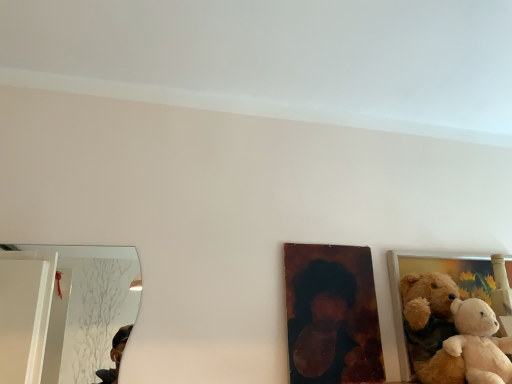
Question: Would you say fluffy fabric teddy bear at right, which is the 2th picture frame from left to right, is part of soft beige plush at right's contents?

Choices:
 (A) yes
 (B) no

Answer: (B)

Question: Considering the relative sizes of soft beige plush at right and fluffy fabric teddy bear at right, which is the 2th picture frame from left to right, in the image provided, is soft beige plush at right taller than fluffy fabric teddy bear at right, which is the 2th picture frame from left to right,?

Choices:
 (A) no
 (B) yes

Answer: (A)

Question: Is soft beige plush at right closer to the viewer compared to fluffy fabric teddy bear at right, which ranks as the 1th picture frame in right-to-left order?

Choices:
 (A) no
 (B) yes

Answer: (B)

Question: Is the surface of soft beige plush at right in direct contact with fluffy fabric teddy bear at right, which ranks as the 1th picture frame in right-to-left order?

Choices:
 (A) yes
 (B) no

Answer: (B)

Question: Is soft beige plush at right to the left of fluffy fabric teddy bear at right, which ranks as the 1th picture frame in right-to-left order, from the viewer's perspective?

Choices:
 (A) no
 (B) yes

Answer: (B)

Question: Does soft beige plush at right have a larger size compared to fluffy fabric teddy bear at right, which is the 2th picture frame from left to right?

Choices:
 (A) yes
 (B) no

Answer: (B)

Question: From a real-world perspective, is fluffy fabric teddy bear at right, which ranks as the 1th picture frame in right-to-left order, under wooden portrait at center, the second picture frame in the right-to-left sequence?

Choices:
 (A) yes
 (B) no

Answer: (A)

Question: Can you confirm if fluffy fabric teddy bear at right, which is the 2th picture frame from left to right, is taller than wooden portrait at center, the second picture frame in the right-to-left sequence?

Choices:
 (A) yes
 (B) no

Answer: (A)

Question: Is fluffy fabric teddy bear at right, which is the 2th picture frame from left to right, facing away from wooden portrait at center, the first picture frame in the left-to-right sequence?

Choices:
 (A) no
 (B) yes

Answer: (A)

Question: Considering the relative sizes of fluffy fabric teddy bear at right, which ranks as the 1th picture frame in right-to-left order, and wooden portrait at center, the first picture frame in the left-to-right sequence, in the image provided, is fluffy fabric teddy bear at right, which ranks as the 1th picture frame in right-to-left order, bigger than wooden portrait at center, the first picture frame in the left-to-right sequence,?

Choices:
 (A) no
 (B) yes

Answer: (B)

Question: Is fluffy fabric teddy bear at right, which is the 2th picture frame from left to right, positioned beyond the bounds of wooden portrait at center, the first picture frame in the left-to-right sequence?

Choices:
 (A) no
 (B) yes

Answer: (B)

Question: From the image's perspective, is fluffy fabric teddy bear at right, which is the 2th picture frame from left to right, beneath wooden portrait at center, the first picture frame in the left-to-right sequence?

Choices:
 (A) yes
 (B) no

Answer: (A)

Question: Considering the relative positions of fluffy fabric teddy bear at right, which ranks as the 1th picture frame in right-to-left order, and soft beige plush at right in the image provided, is fluffy fabric teddy bear at right, which ranks as the 1th picture frame in right-to-left order, in front of soft beige plush at right?

Choices:
 (A) no
 (B) yes

Answer: (A)